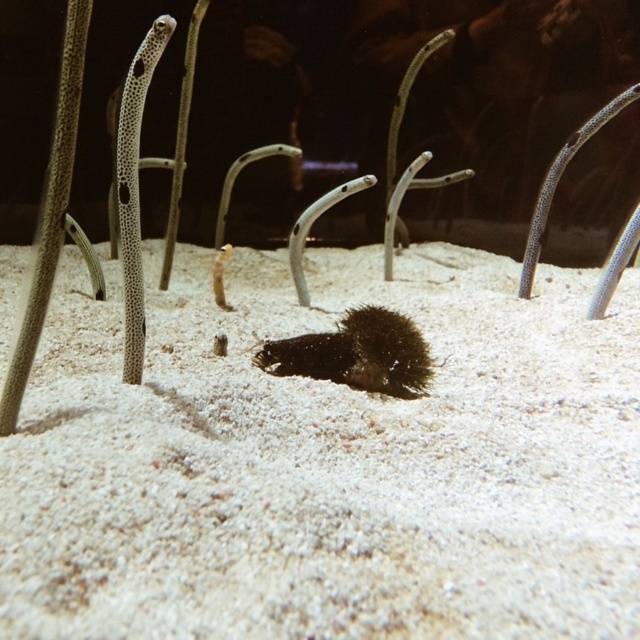
You are an underwater photographer aiming to capture a clear shot of both point (116, 620) and point (333, 371) in the aquarium. Since you can only focus on one point at a time, which point should you focus on to ensure the other is also in acceptable focus? Please explain your reasoning based on their spatial relationship.

You should focus on point (333, 371) because it is farther away from you than point (116, 620). By focusing on the farther point, the closer point will still be within the depth of field, ensuring both are acceptably sharp.

You are an underwater photographer aiming to capture a closeup shot of the dark fuzzy sea urchin at center and the speckled skin garden eel at left. Your camera can only focus on objects within a 10 cm width. Given their sizes, will both fit within the camera frame?

The dark fuzzy sea urchin at center has a larger width than the speckled skin garden eel at left. Since the camera can only focus on objects within a 10 cm width, you need to check if both widths individually are under 10 cm. However, the description only states their relative sizes, not exact measurements. Without knowing their actual widths, it is impossible to determine if they fit.

You are an underwater explorer observing the scene. You see the white sandy bottom at center and the dark fuzzy sea urchin at center. Which object is located to the right of the other?

The white sandy bottom at center is positioned on the right side of dark fuzzy sea urchin at center.